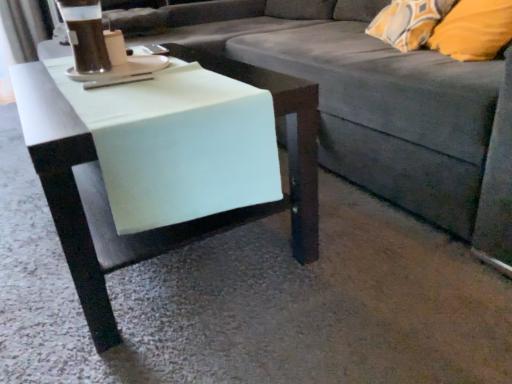
Question: Does gray fabric couch at center have a greater width compared to dark brown liquid at upper left?

Choices:
 (A) no
 (B) yes

Answer: (B)

Question: Does gray fabric couch at center turn towards dark brown liquid at upper left?

Choices:
 (A) no
 (B) yes

Answer: (B)

Question: Considering the relative sizes of gray fabric couch at center and dark brown liquid at upper left in the image provided, is gray fabric couch at center shorter than dark brown liquid at upper left?

Choices:
 (A) yes
 (B) no

Answer: (B)

Question: Does gray fabric couch at center touch dark brown liquid at upper left?

Choices:
 (A) yes
 (B) no

Answer: (B)

Question: Is gray fabric couch at center not near dark brown liquid at upper left?

Choices:
 (A) no
 (B) yes

Answer: (A)

Question: Is gray fabric couch at center taller or shorter than white matte table at center?

Choices:
 (A) short
 (B) tall

Answer: (B)

Question: Is point (473, 177) closer or farther from the camera than point (79, 263)?

Choices:
 (A) farther
 (B) closer

Answer: (A)

Question: From the image's perspective, relative to white matte table at center, is gray fabric couch at center above or below?

Choices:
 (A) above
 (B) below

Answer: (A)

Question: Which is correct: gray fabric couch at center is inside white matte table at center, or outside of it?

Choices:
 (A) outside
 (B) inside

Answer: (A)

Question: From the image's perspective, is white matte table at center positioned above or below white glossy saucer at upper left?

Choices:
 (A) above
 (B) below

Answer: (B)

Question: From a real-world perspective, is white matte table at center physically located above or below white glossy saucer at upper left?

Choices:
 (A) below
 (B) above

Answer: (A)

Question: In the image, is white matte table at center positioned in front of or behind white glossy saucer at upper left?

Choices:
 (A) behind
 (B) front

Answer: (B)

Question: Based on their positions, is white matte table at center located to the left or right of white glossy saucer at upper left?

Choices:
 (A) left
 (B) right

Answer: (B)

Question: Is gray fabric couch at center bigger or smaller than dark brown liquid at upper left?

Choices:
 (A) big
 (B) small

Answer: (A)

Question: Would you say gray fabric couch at center is to the left or to the right of dark brown liquid at upper left in the picture?

Choices:
 (A) left
 (B) right

Answer: (B)